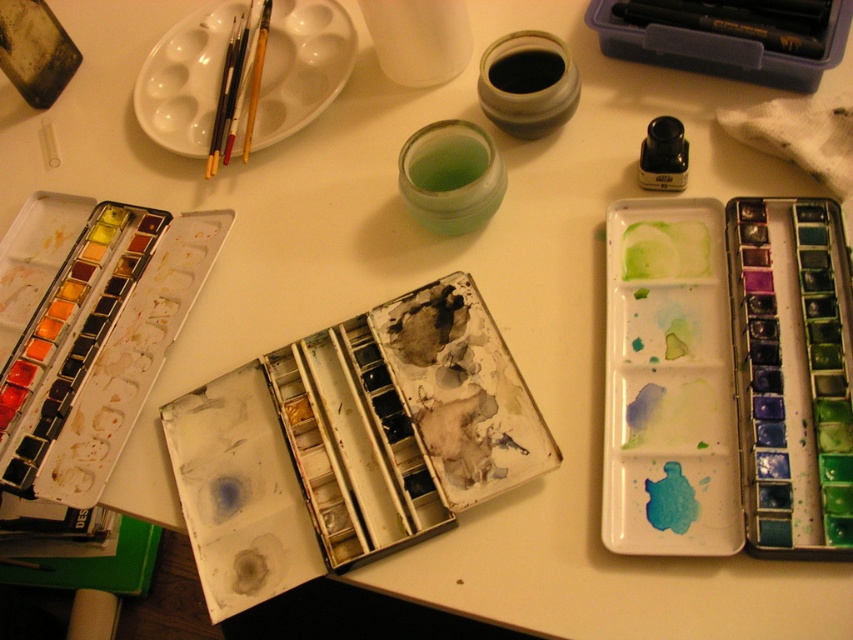
You are an artist trying to reach for your tools. You want to pick up the black plastic pencil at upper right first. Is it easier to grab it before the yellow wood paint brush at upper left because it is closer to you?

Yes, the black plastic pencil at upper right is in front of the yellow wood paint brush at upper left, so it is closer and easier to grab first.